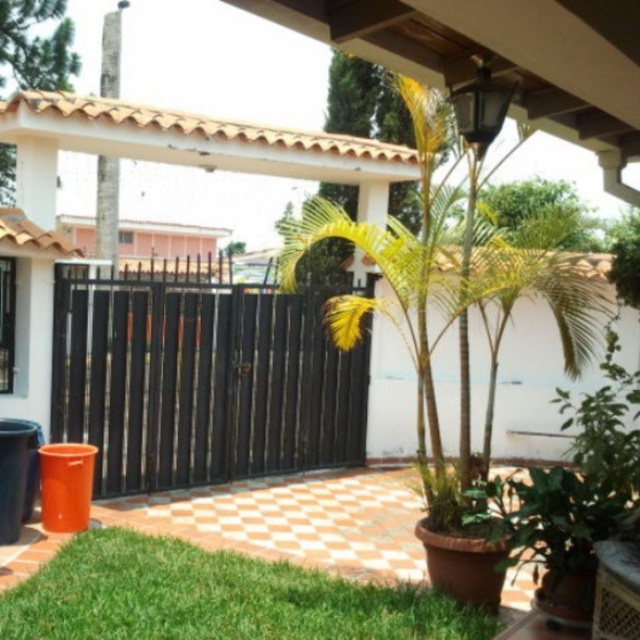
Question: Which point is farther from the camera taking this photo?

Choices:
 (A) (115, 634)
 (B) (134, 452)

Answer: (B)

Question: Observing the image, what is the correct spatial positioning of black metal gate at center in reference to green leafy plant at lower left?

Choices:
 (A) below
 (B) above

Answer: (B)

Question: Is black metal gate at center bigger than green leafy plant at lower left?

Choices:
 (A) yes
 (B) no

Answer: (A)

Question: Which point is closer to the camera?

Choices:
 (A) (308, 380)
 (B) (22, 593)

Answer: (B)

Question: Is black metal gate at center to the left of green leafy plant at lower left from the viewer's perspective?

Choices:
 (A) yes
 (B) no

Answer: (A)